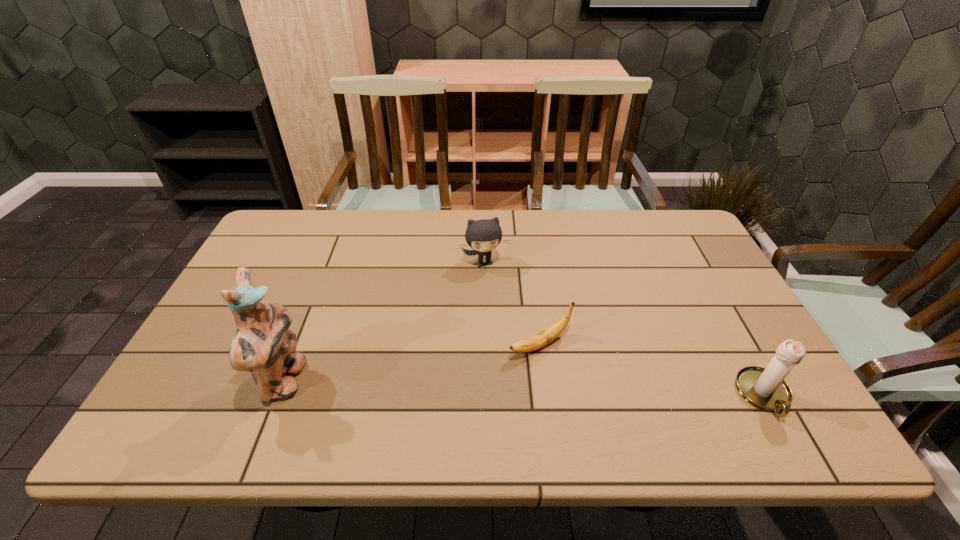
The image size is (960, 540). What are the coordinates of `free region located 0.110m on the front-facing side of the kitten` in the screenshot? It's located at (494, 297).

This screenshot has height=540, width=960. What are the coordinates of `blank space located 0.310m on the front-facing side of the kitten` in the screenshot? It's located at (509, 353).

The width and height of the screenshot is (960, 540). I want to click on object positioned at the far edge, so click(484, 235).

You are a GUI agent. You are given a task and a screenshot of the screen. Output one action in this format:
    pyautogui.click(x=<x>, y=<y>)
    Task: Click on the figurine that is at the near edge
    This screenshot has width=960, height=540.
    Given the screenshot: What is the action you would take?
    pyautogui.click(x=263, y=345)

You are a GUI agent. You are given a task and a screenshot of the screen. Output one action in this format:
    pyautogui.click(x=<x>, y=<y>)
    Task: Click on the candle holder that is at the near edge
    This screenshot has width=960, height=540.
    Given the screenshot: What is the action you would take?
    pyautogui.click(x=766, y=389)

Where is `object situated at the right edge`? object situated at the right edge is located at coordinates (766, 389).

Locate an element on the screen. This screenshot has height=540, width=960. object positioned at the near right corner is located at coordinates (766, 389).

I want to click on vacant space at the far edge of the desktop, so click(x=527, y=214).

Locate an element on the screen. Image resolution: width=960 pixels, height=540 pixels. vacant position at the near edge of the desktop is located at coordinates (510, 381).

This screenshot has width=960, height=540. In order to click on free location at the left edge in this screenshot , I will do `click(286, 286)`.